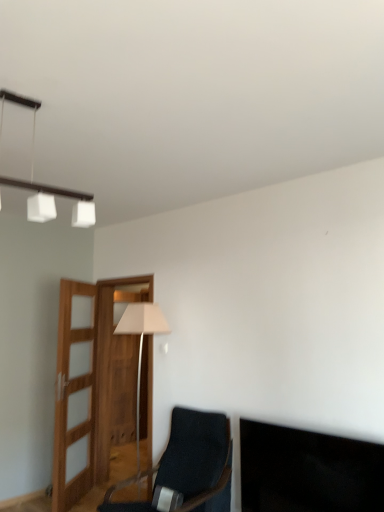
Question: From the image's perspective, is white matte cube at upper left above or below black glossy tv at lower right?

Choices:
 (A) above
 (B) below

Answer: (A)

Question: Looking at their shapes, would you say white matte cube at upper left is wider or thinner than black glossy tv at lower right?

Choices:
 (A) thin
 (B) wide

Answer: (A)

Question: Based on their relative distances, which object is farther from the black glossy tv at lower right?

Choices:
 (A) white matte cube at upper left
 (B) white fabric lampshade at center
 (C) dark blue fabric chair at center

Answer: (A)

Question: Based on their relative distances, which object is farther from the white matte cube at upper left?

Choices:
 (A) white fabric lampshade at center
 (B) dark blue fabric chair at center
 (C) black glossy tv at lower right

Answer: (B)